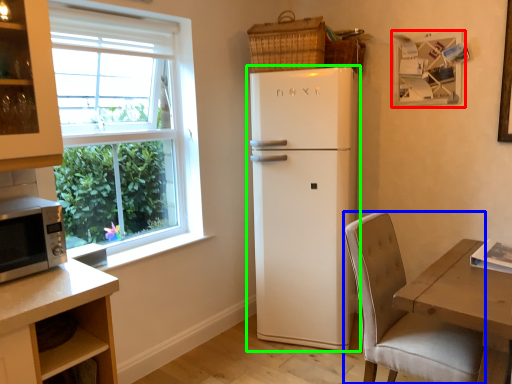
Question: Which object is the closest to the picture frame (highlighted by a red box)? Choose among these: chair (highlighted by a blue box) or refrigerator (highlighted by a green box).

Choices:
 (A) chair
 (B) refrigerator

Answer: (B)